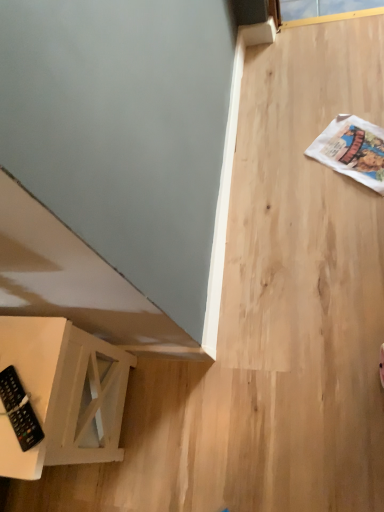
At what (x,y) coordinates should I click in order to perform the action: click on free point behind black plastic remote at lower left. Please return your answer as a coordinate pair (x, y). Looking at the image, I should click on (25, 338).